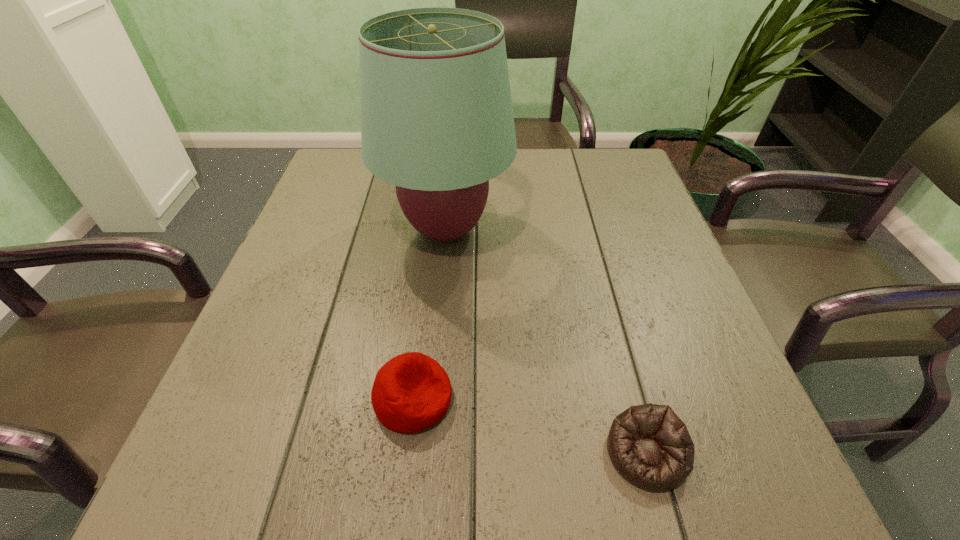
Locate which object is the second closest to the farthest object. Please provide its 2D coordinates. Your answer should be formatted as a tuple, i.e. [(x, y)], where the tuple contains the x and y coordinates of a point satisfying the conditions above.

[(649, 445)]

Find the location of a particular element. free spot that satisfies the following two spatial constraints: 1. on the seat area of the second tallest object; 2. on the right side of the rightmost object is located at coordinates (407, 453).

Where is `blank area in the image that satisfies the following two spatial constraints: 1. on the seat area of the right beanbag; 2. on the right side of the second shortest object`? The width and height of the screenshot is (960, 540). blank area in the image that satisfies the following two spatial constraints: 1. on the seat area of the right beanbag; 2. on the right side of the second shortest object is located at coordinates coord(407,453).

The width and height of the screenshot is (960, 540). Identify the location of free space that satisfies the following two spatial constraints: 1. on the seat area of the left beanbag; 2. on the right side of the rightmost object. (407, 453).

What are the coordinates of `free spot that satisfies the following two spatial constraints: 1. on the seat area of the rightmost object; 2. on the right side of the second tallest object` in the screenshot? It's located at (407, 453).

Locate an element on the screen. The height and width of the screenshot is (540, 960). free space that satisfies the following two spatial constraints: 1. on the seat area of the second shortest object; 2. on the left side of the rightmost object is located at coordinates (407, 453).

The height and width of the screenshot is (540, 960). What are the coordinates of `vacant space that satisfies the following two spatial constraints: 1. on the seat area of the shortest object; 2. on the right side of the second tallest object` in the screenshot? It's located at (407, 453).

This screenshot has height=540, width=960. In order to click on vacant space that satisfies the following two spatial constraints: 1. on the front side of the farthest object; 2. on the seat area of the second shortest object in this screenshot , I will do `click(431, 399)`.